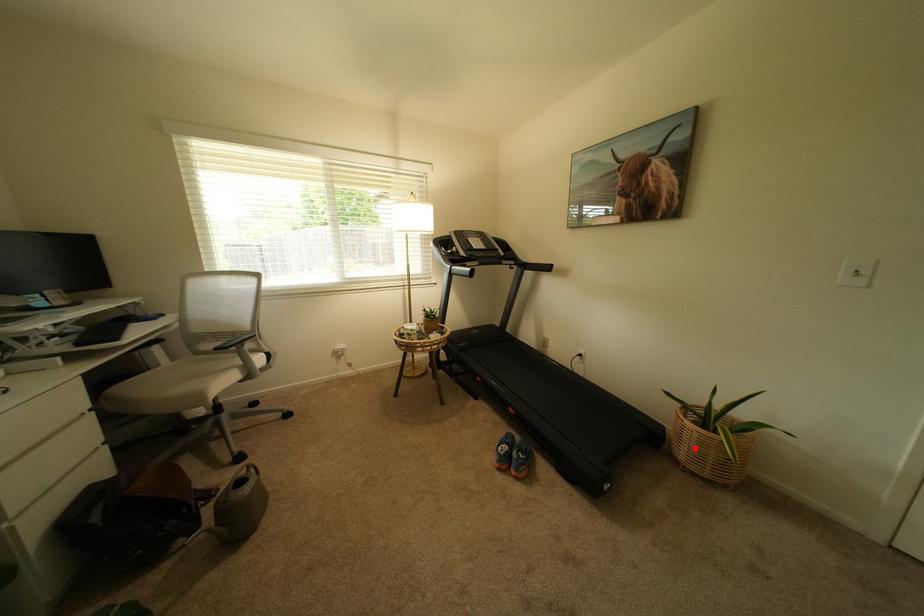
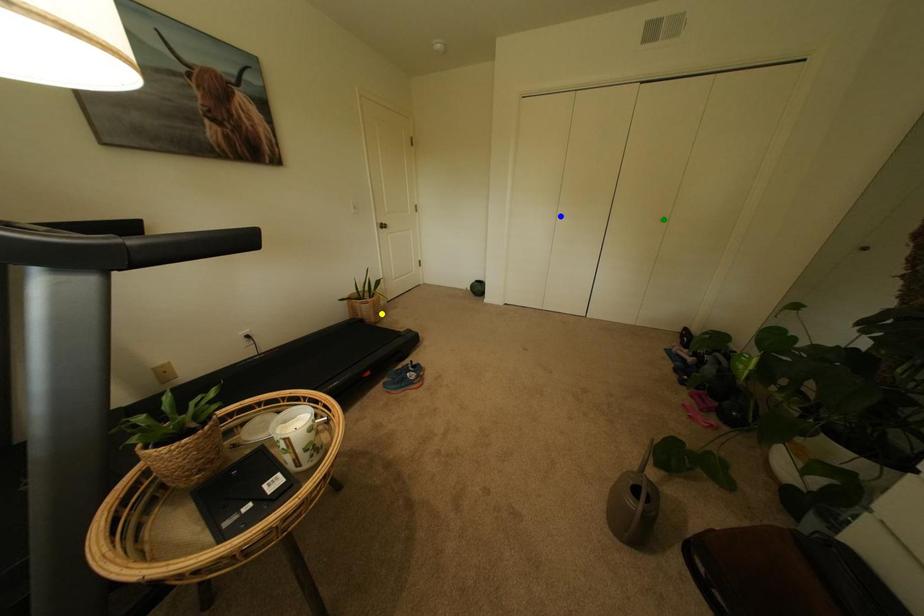
Question: I am providing you with two images of the same scene from different viewpoints. A red point is marked on the first image. You are given multiple points on the second image. Can you choose the point in image 2 that corresponds to the point in image 1?

Choices:
 (A) yellow point
 (B) green point
 (C) blue point

Answer: (A)